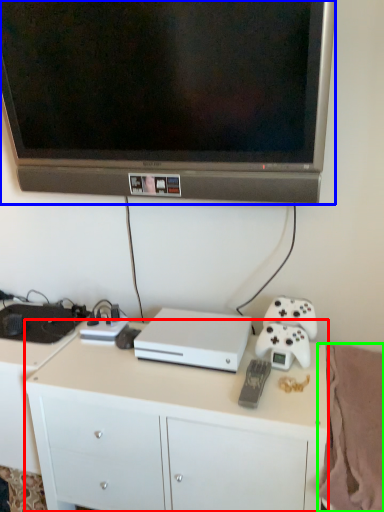
Question: Which object is the closest to the desk (highlighted by a red box)? Choose among these: television (highlighted by a blue box) or blanket (highlighted by a green box).

Choices:
 (A) television
 (B) blanket

Answer: (B)